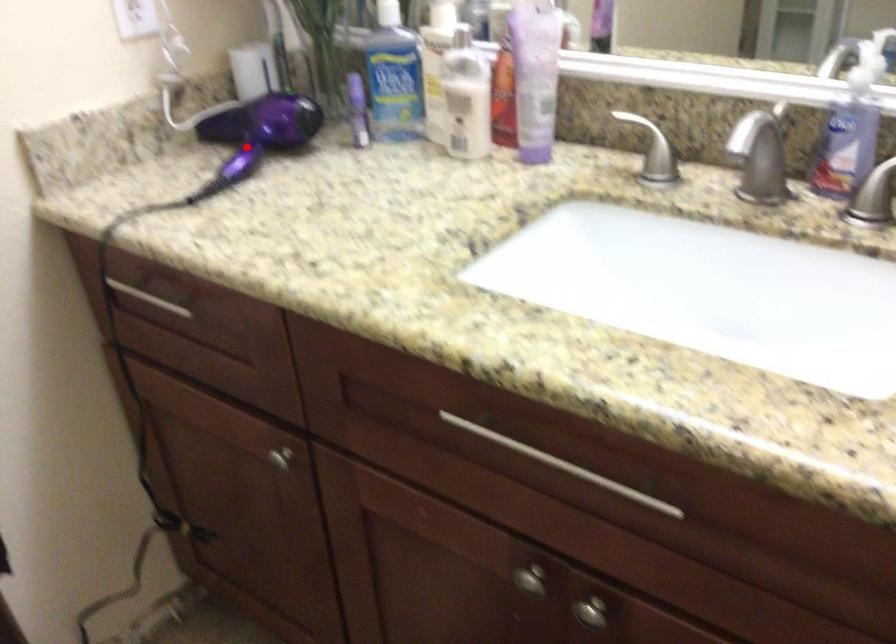
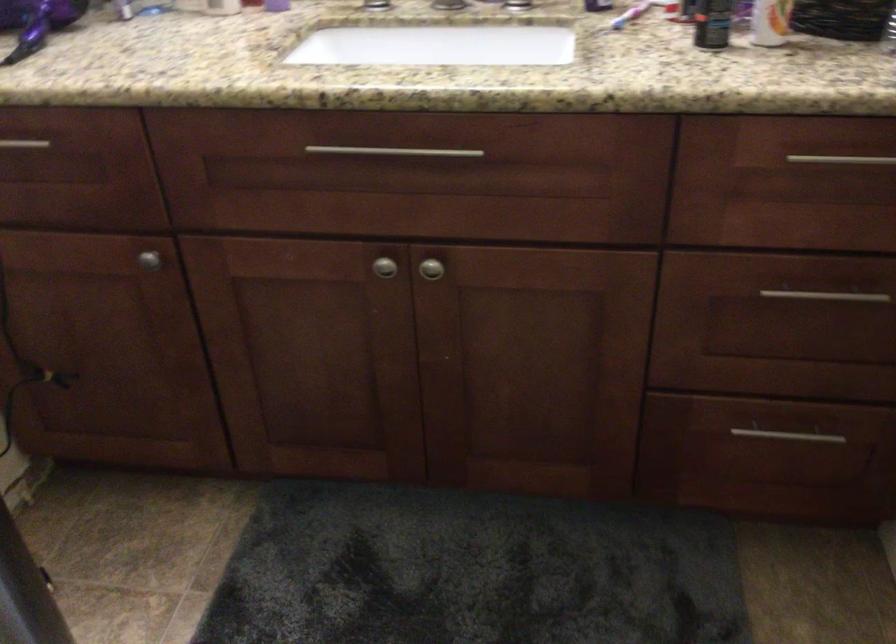
Where in the second image is the point corresponding to the highlighted location from the first image?

(37, 22)